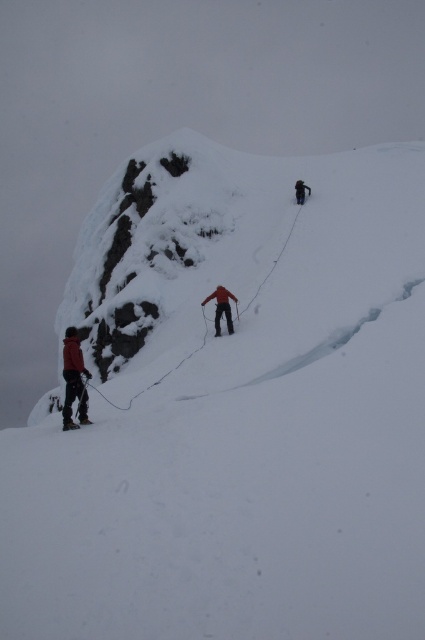
From the picture: You are a photographer standing at the base of the mountain and want to take a photo of the matte red jacket at lower left and the matte black ski at lower left. If your camera can focus on objects within 16 inches, will both items be in focus?

The matte red jacket at lower left is 16.53 inches away from the matte black ski at lower left. Since the distance between them exceeds the camera focus range of 16 inches, both items may not be in focus simultaneously.

A rescue team member is standing at the base of the mountain and needs to reach the matte red jacket at lower left as quickly as possible. If they can move at a speed of 4 feet per second on the snow, how many seconds will it take them to reach the jacket?

The matte red jacket at lower left is 64.06 feet away from the viewer. At a speed of 4 feet per second, the rescue team member would take 64.06 divided by 4, which equals approximately 16.015 seconds to reach the jacket.

You are a climber on the snowy mountain slope. You notice two points marked on your map. The first point is at coordinates point (65, 339) and the second point is at point (299, 189). According to the map, which point is closer to you?

Point (65, 339) is in front of point (299, 189), so it is closer to you.